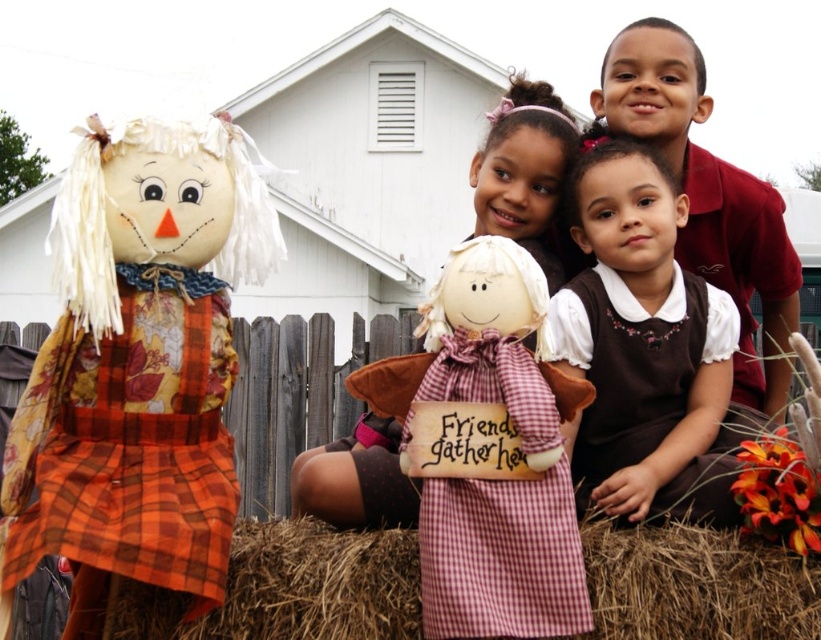
Question: Observing the image, what is the correct spatial positioning of matte plaid scarecrow at left in reference to brown cotton dress at center?

Choices:
 (A) below
 (B) above

Answer: (A)

Question: Which point appears farthest from the camera in this image?

Choices:
 (A) (469, 609)
 (B) (636, 412)

Answer: (B)

Question: Does brown cotton dress at center come behind red checkered fabric doll at center?

Choices:
 (A) no
 (B) yes

Answer: (B)

Question: Is brown cotton dress at center in front of red checkered fabric doll at center?

Choices:
 (A) no
 (B) yes

Answer: (A)

Question: Considering the real-world distances, which object is closest to the matte plaid scarecrow at left?

Choices:
 (A) white fabric doll at center
 (B) brown cotton dress at center

Answer: (A)

Question: Which point is closer to the camera?

Choices:
 (A) (308, 460)
 (B) (634, 243)
 (C) (187, 132)

Answer: (C)